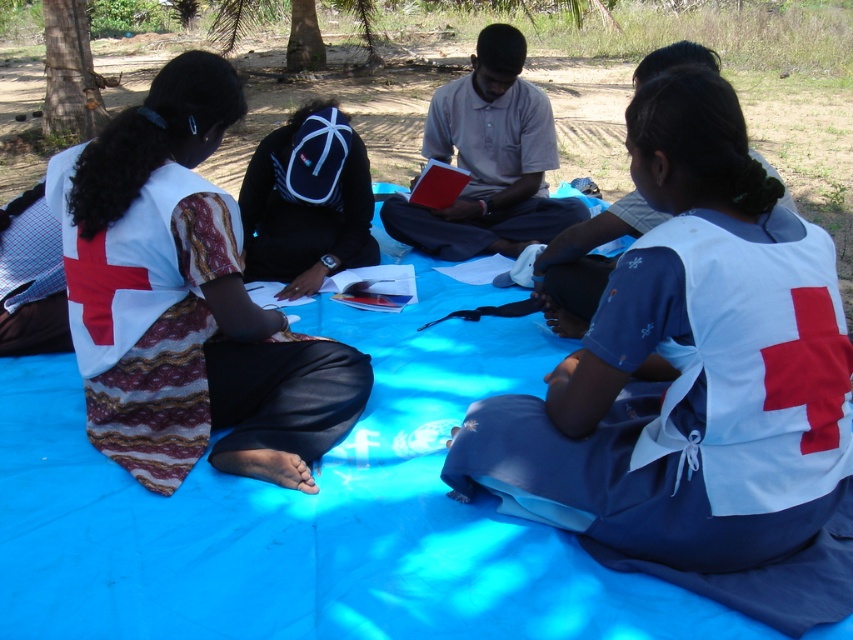
From the picture: You are a hiker who just arrived at the scene and need to place your navy blue backpack at center and smooth brown tree trunk at upper left. According to the scene, which object is located to the right of the other?

The navy blue backpack at center is positioned on the right side of smooth brown tree trunk at upper left.

You are planning to place a navy blue backpack at center and a smooth brown tree trunk at upper left in a scene. Based on their thickness, which object would require more space when moving them side by side?

The smooth brown tree trunk at upper left is thicker than the navy blue backpack at center, so it would require more space when moving them side by side.

You are a photographer who needs to capture a closeup of the navy blue backpack at center without moving it. Your camera has a maximum zoom range of 2 meters. Can you take the photo from where you are standing?

The navy blue backpack at center and camera are 3.11 meters apart. Since the camera can only zoom up to 2 meters, you cannot take a closeup of the navy blue backpack at center from your current position without moving it.